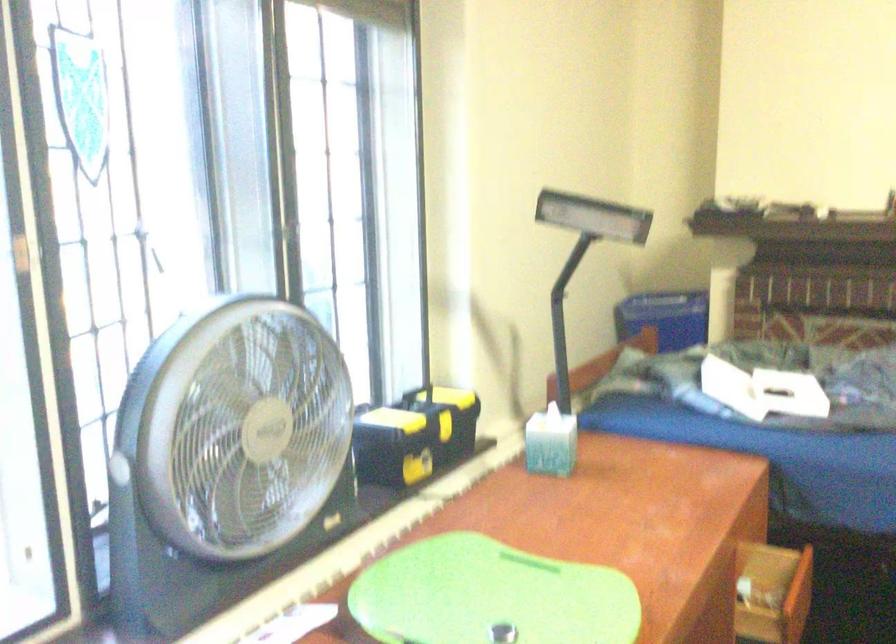
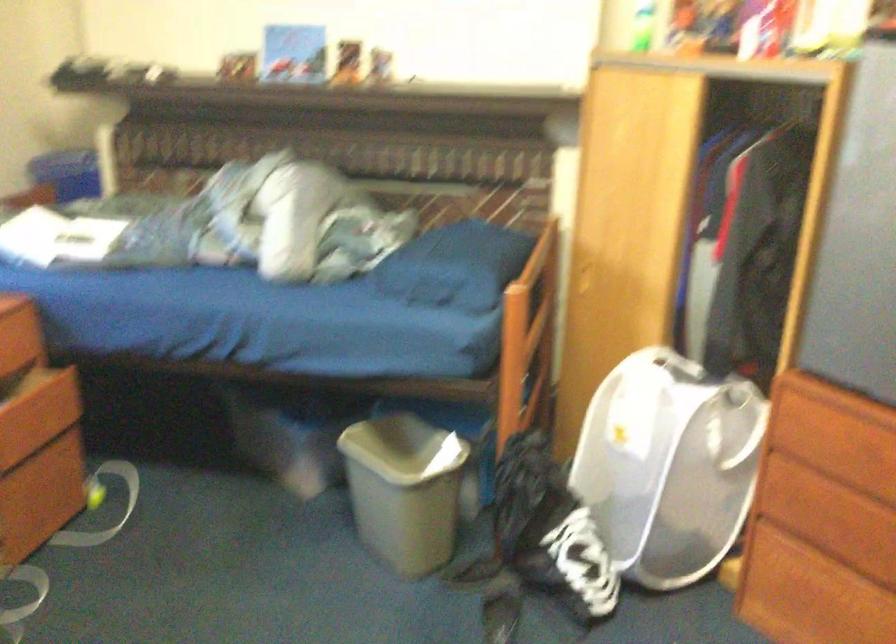
Which direction would the cameraman need to move to produce the second image?

The cameraman walked toward right, backward.